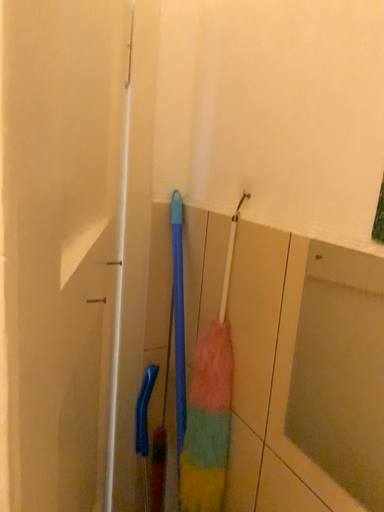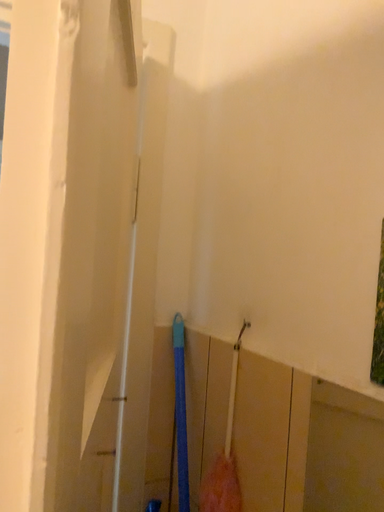
Question: Which way did the camera rotate in the video?

Choices:
 (A) rotated downward
 (B) rotated upward

Answer: (B)